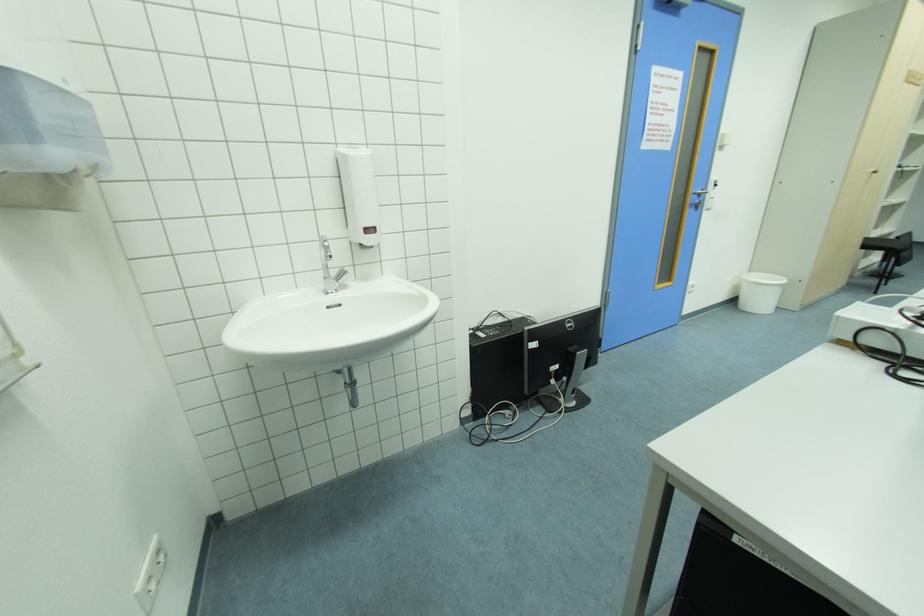
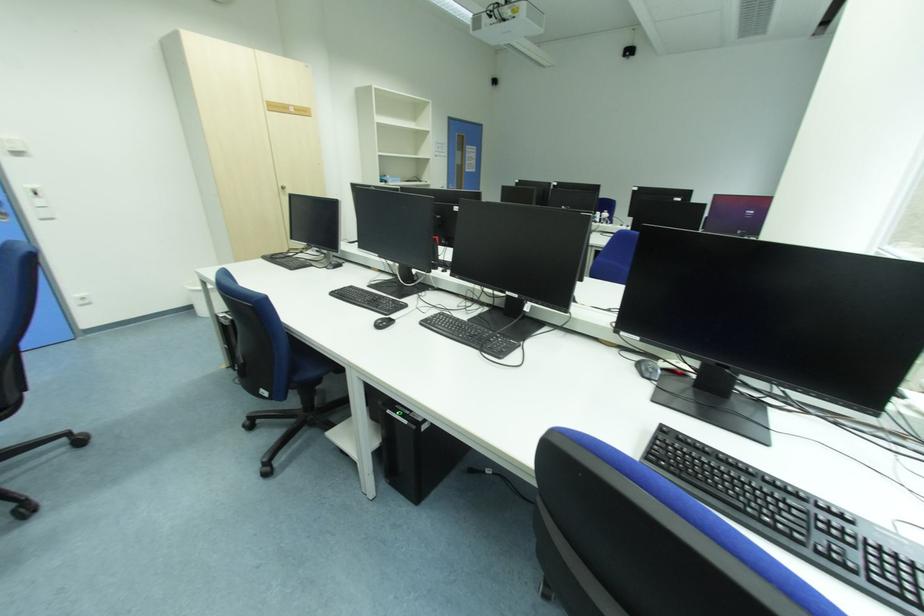
Question: In a continuous first-person perspective shot, in which direction is the camera moving?

Choices:
 (A) Left
 (B) Right
 (C) Forward
 (D) Backward

Answer: (B)